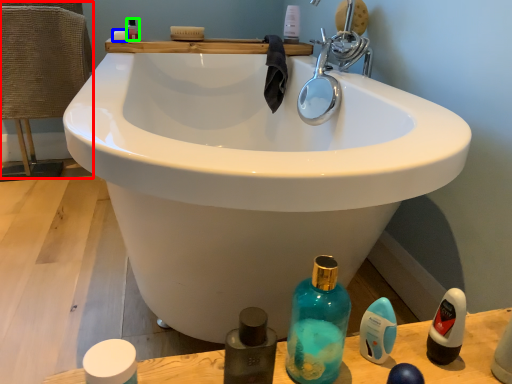
Question: Which object is the closest to the chair (highlighted by a red box)? Choose among these: soap (highlighted by a blue box) or mouthwash (highlighted by a green box).

Choices:
 (A) soap
 (B) mouthwash

Answer: (B)